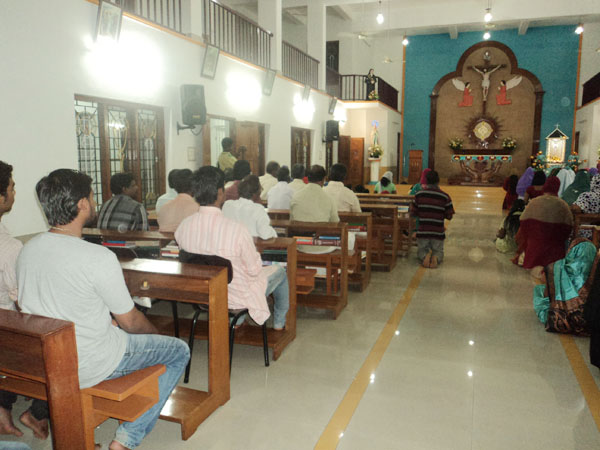
Find the location of a particular element. pew is located at coordinates (91, 404), (261, 297), (308, 270), (351, 256), (378, 232).